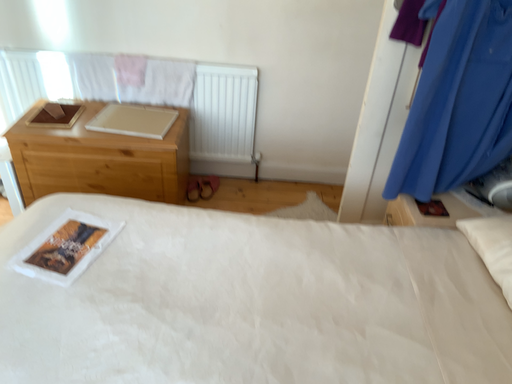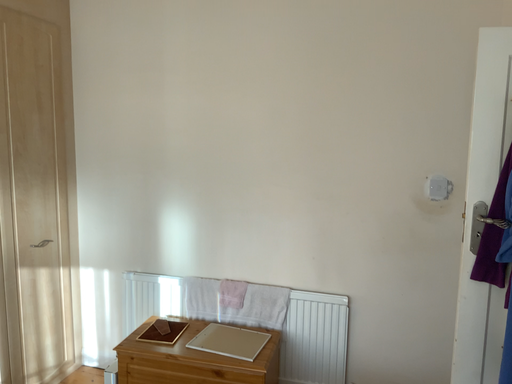
Question: Which way did the camera rotate in the video?

Choices:
 (A) rotated left
 (B) rotated right

Answer: (A)